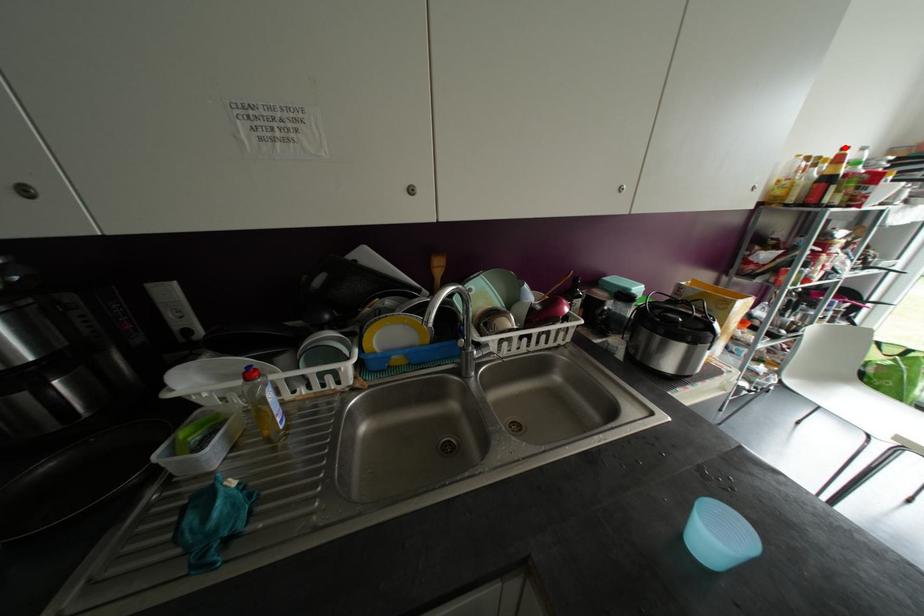
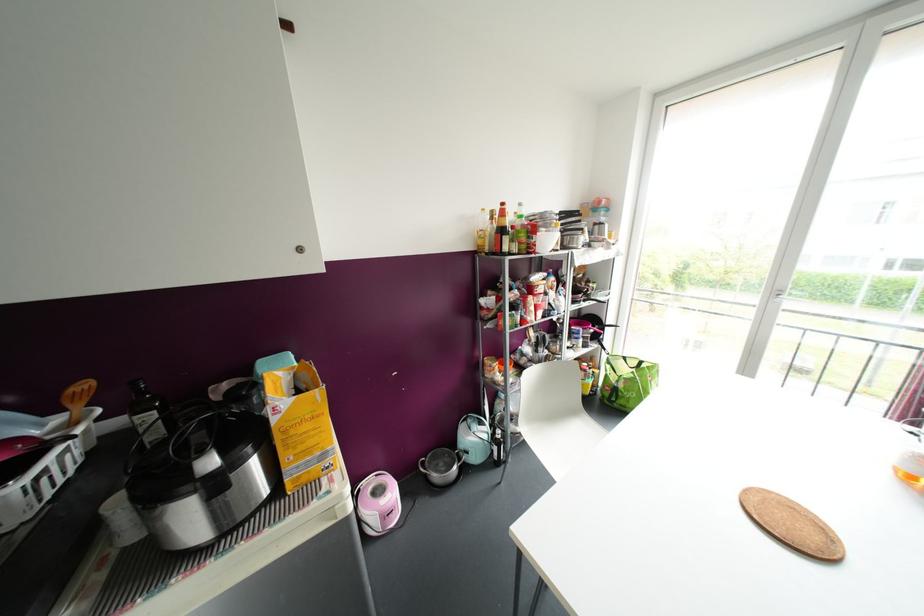
The point at the highlighted location is marked in the first image. Where is the corresponding point in the second image?

(502, 204)